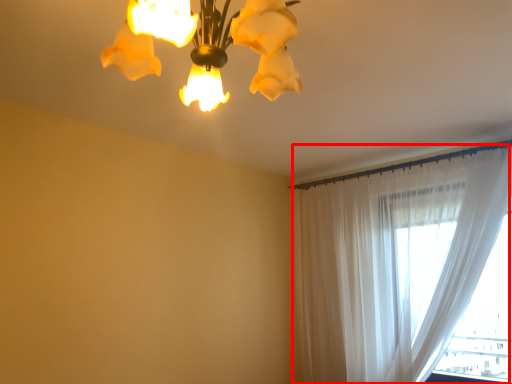
Question: From the image's perspective, considering the relative positions of curtain (annotated by the red box) and lamp in the image provided, where is curtain (annotated by the red box) located with respect to the staircase?

Choices:
 (A) above
 (B) below

Answer: (B)